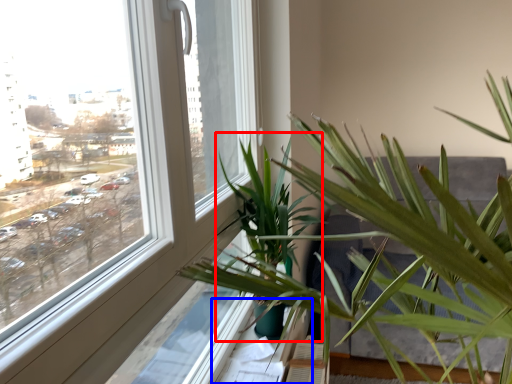
Question: Which object appears closest to the camera in this image, palm tree (highlighted by a red box) or window sill (highlighted by a blue box)?

Choices:
 (A) palm tree
 (B) window sill

Answer: (A)